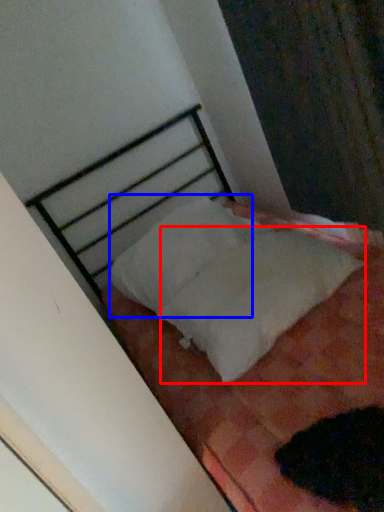
Question: Which of the following is the farthest to the observer, sheet (highlighted by a red box) or pillow (highlighted by a blue box)?

Choices:
 (A) sheet
 (B) pillow

Answer: (B)